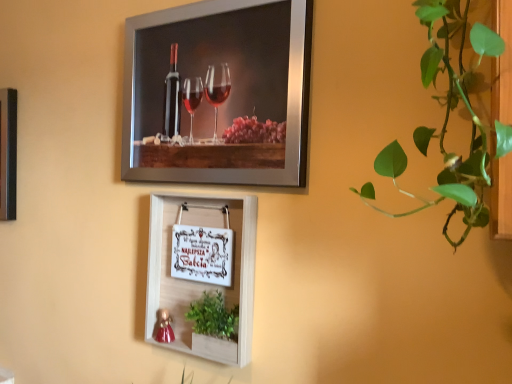
Question: Is the depth of white wood picture frame at center, the 2th picture frame positioned from the top, less than that of green leafy plant at lower center?

Choices:
 (A) yes
 (B) no

Answer: (B)

Question: Is white wood picture frame at center, acting as the 1th picture frame starting from the bottom, further to the viewer compared to green leafy plant at lower center?

Choices:
 (A) yes
 (B) no

Answer: (A)

Question: Is white wood picture frame at center, acting as the 1th picture frame starting from the bottom, facing away from green leafy plant at lower center?

Choices:
 (A) no
 (B) yes

Answer: (B)

Question: Can you confirm if white wood picture frame at center, the 2th picture frame positioned from the top, is shorter than green leafy plant at lower center?

Choices:
 (A) yes
 (B) no

Answer: (B)

Question: Are white wood picture frame at center, the 2th picture frame positioned from the top, and green leafy plant at lower center far apart?

Choices:
 (A) no
 (B) yes

Answer: (A)

Question: In terms of height, does metallic silver picture frame at upper center, marked as the first picture frame in a top-to-bottom arrangement, look taller or shorter compared to green leafy plant at right?

Choices:
 (A) tall
 (B) short

Answer: (A)

Question: Considering the positions of point (275, 180) and point (443, 180), is point (275, 180) closer or farther from the camera than point (443, 180)?

Choices:
 (A) closer
 (B) farther

Answer: (B)

Question: From a real-world perspective, relative to green leafy plant at right, is metallic silver picture frame at upper center, positioned as the second picture frame in bottom-to-top order, vertically above or below?

Choices:
 (A) below
 (B) above

Answer: (B)

Question: From the image's perspective, is metallic silver picture frame at upper center, marked as the first picture frame in a top-to-bottom arrangement, located above or below green leafy plant at right?

Choices:
 (A) below
 (B) above

Answer: (B)

Question: Relative to white wood picture frame at center, acting as the 1th picture frame starting from the bottom, is metallic silver picture frame at upper center, positioned as the second picture frame in bottom-to-top order, in front or behind?

Choices:
 (A) behind
 (B) front

Answer: (B)

Question: From the image's perspective, is metallic silver picture frame at upper center, positioned as the second picture frame in bottom-to-top order, positioned above or below white wood picture frame at center, the 2th picture frame positioned from the top?

Choices:
 (A) below
 (B) above

Answer: (B)

Question: From a real-world perspective, is metallic silver picture frame at upper center, marked as the first picture frame in a top-to-bottom arrangement, positioned above or below white wood picture frame at center, the 2th picture frame positioned from the top?

Choices:
 (A) above
 (B) below

Answer: (A)

Question: Considering the positions of metallic silver picture frame at upper center, positioned as the second picture frame in bottom-to-top order, and white wood picture frame at center, acting as the 1th picture frame starting from the bottom, in the image, is metallic silver picture frame at upper center, positioned as the second picture frame in bottom-to-top order, taller or shorter than white wood picture frame at center, acting as the 1th picture frame starting from the bottom,?

Choices:
 (A) short
 (B) tall

Answer: (B)

Question: Is point (188, 152) positioned closer to the camera than point (233, 319)?

Choices:
 (A) farther
 (B) closer

Answer: (A)

Question: Is metallic silver picture frame at upper center, marked as the first picture frame in a top-to-bottom arrangement, in front of or behind green leafy plant at lower center in the image?

Choices:
 (A) behind
 (B) front

Answer: (B)